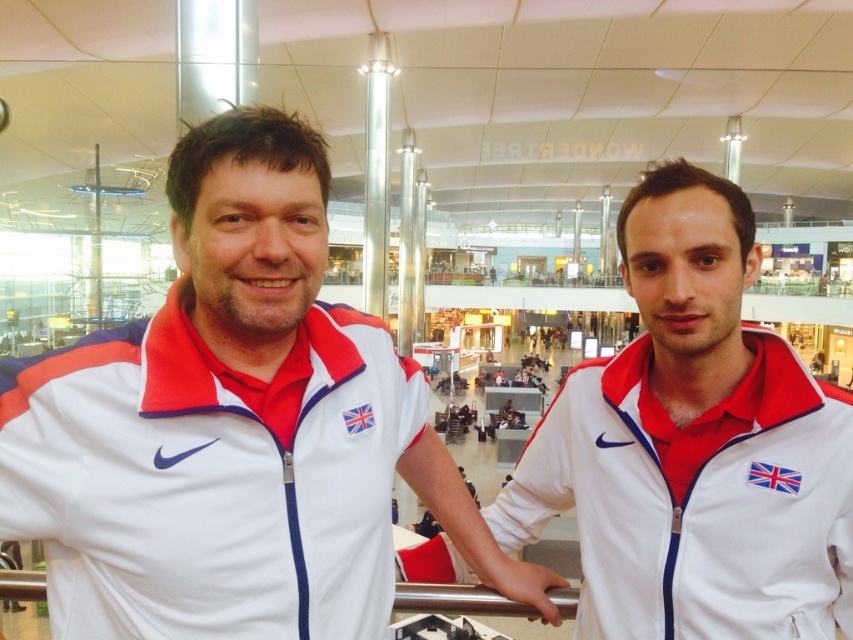
Question: Can you confirm if white fabric jacket at left is wider than white fabric jacket at center?

Choices:
 (A) yes
 (B) no

Answer: (A)

Question: Is the position of white fabric jacket at left less distant than that of white fabric jacket at center?

Choices:
 (A) yes
 (B) no

Answer: (A)

Question: Which of the following is the closest to the observer?

Choices:
 (A) (148, 464)
 (B) (827, 547)

Answer: (A)

Question: Which point is closer to the camera?

Choices:
 (A) white fabric jacket at left
 (B) white fabric jacket at center

Answer: (A)

Question: Can you confirm if white fabric jacket at left is positioned above white fabric jacket at center?

Choices:
 (A) no
 (B) yes

Answer: (B)